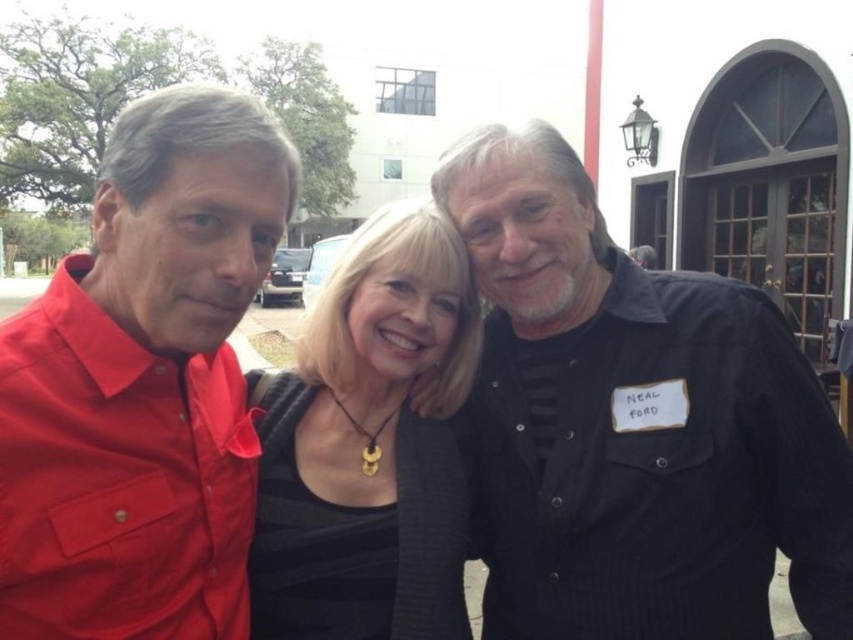
You are a photographer trying to adjust the lighting for a group photo. You notice two black items at the center of the image. Which one is closer to the camera between the black textured shirt at center and the black matte dress at center?

The black textured shirt at center is in front of the black matte dress at center, so it is closer to the camera.

You are a photographer adjusting the camera settings for a group photo. You notice the matte red shirt at left and the black matte dress at center. Which of these two items is smaller in size?

The matte red shirt at left is smaller in size compared to the black matte dress at center.

You are a photographer setting up for a group photo. You need to ensure that the black textured shirt at center and the black matte dress at center are at least 50 centimeters apart to avoid overlapping in the frame. Based on the current positioning shown in the image, is this requirement met?

The black textured shirt at center is 43.36 centimeters from the black matte dress at center, which is less than the required 50 centimeters. Therefore, the requirement is not met, and they are too close to avoid overlapping in the frame.